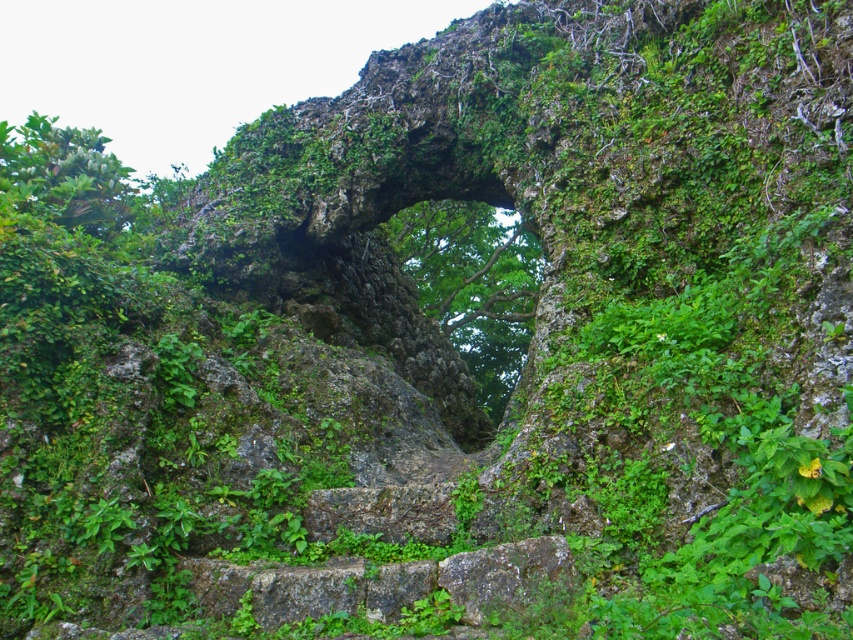
Question: Does green leafy tree at center have a smaller size compared to green leafy tree at upper left?

Choices:
 (A) yes
 (B) no

Answer: (A)

Question: Does green leafy tree at center have a larger size compared to green leafy tree at upper left?

Choices:
 (A) yes
 (B) no

Answer: (B)

Question: Which point appears farthest from the camera in this image?

Choices:
 (A) (102, 218)
 (B) (440, 285)

Answer: (B)

Question: Is green leafy tree at center further to camera compared to green leafy tree at upper left?

Choices:
 (A) yes
 (B) no

Answer: (A)